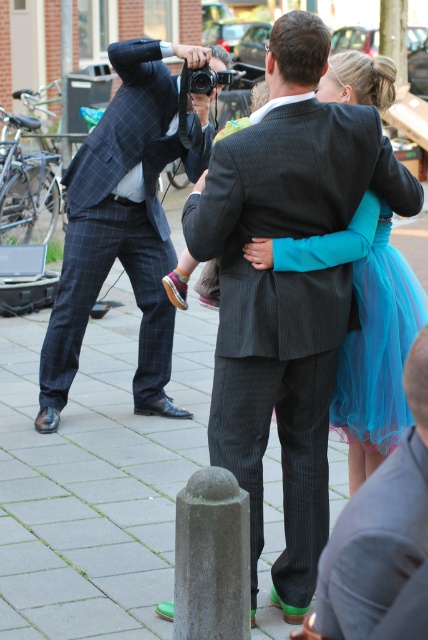
You are a photographer at a wedding event. You want to capture a photo of the plaid wool suit at left and the woman in the turquoise dress. How far apart should you position them to ensure they are in the same frame?

The plaid wool suit at left and the woman in the turquoise dress are 19.93 feet apart, so to ensure they are in the same frame, position them at that distance.

You are a photographer trying to capture a candid shot of the couple in the dark gray pinstripe suit at center and the matte black camera at upper center. Which object should you focus on first if you want to ensure both are in focus?

The dark gray pinstripe suit at center is below the matte black camera at upper center. To ensure both are in focus, you should focus on the matte black camera at upper center first since it is farther away, allowing the depth of field to cover the closer subject.

You are a photographer standing at the camera position. You want to adjust your zoom lens to frame the plaid wool suit at left without including the background buildings. What should you do?

Since the plaid wool suit at left is 19.93 feet away from the camera, you can zoom in to reduce the field of view and exclude the background buildings while keeping the plaid wool suit at left in focus.